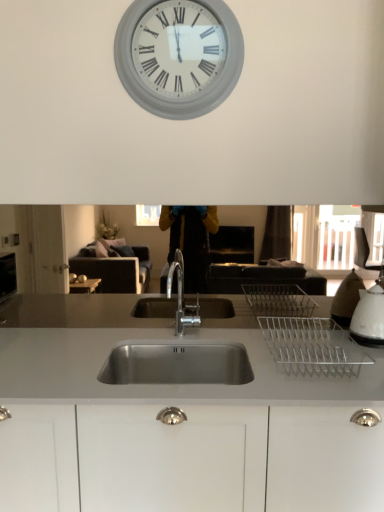
Question: Does white matte clock at upper center contain white glossy kettle at right?

Choices:
 (A) yes
 (B) no

Answer: (B)

Question: Does white matte clock at upper center appear on the left side of white glossy kettle at right?

Choices:
 (A) yes
 (B) no

Answer: (A)

Question: Is white matte clock at upper center positioned in front of white glossy kettle at right?

Choices:
 (A) yes
 (B) no

Answer: (B)

Question: Considering the relative sizes of white matte clock at upper center and white glossy kettle at right in the image provided, is white matte clock at upper center bigger than white glossy kettle at right?

Choices:
 (A) yes
 (B) no

Answer: (A)

Question: Is white matte clock at upper center looking in the opposite direction of white glossy kettle at right?

Choices:
 (A) no
 (B) yes

Answer: (A)

Question: Considering their positions, is white glossy kettle at right located in front of or behind white matte clock at upper center?

Choices:
 (A) front
 (B) behind

Answer: (A)

Question: From the image's perspective, is white glossy kettle at right positioned above or below white matte clock at upper center?

Choices:
 (A) above
 (B) below

Answer: (B)

Question: From a real-world perspective, relative to white matte clock at upper center, is white glossy kettle at right vertically above or below?

Choices:
 (A) below
 (B) above

Answer: (A)

Question: In the image, is white glossy kettle at right on the left side or the right side of white matte clock at upper center?

Choices:
 (A) right
 (B) left

Answer: (A)

Question: Is white matte clock at upper center inside the boundaries of white glossy kettle at right, or outside?

Choices:
 (A) outside
 (B) inside

Answer: (A)

Question: Would you say white matte clock at upper center is to the left or to the right of white glossy kettle at right in the picture?

Choices:
 (A) left
 (B) right

Answer: (A)

Question: From the image's perspective, is white matte clock at upper center located above or below white glossy kettle at right?

Choices:
 (A) above
 (B) below

Answer: (A)

Question: Is white matte clock at upper center wider or thinner than white glossy kettle at right?

Choices:
 (A) thin
 (B) wide

Answer: (A)

Question: Is stainless steel sink at center taller or shorter than white glossy kettle at right?

Choices:
 (A) short
 (B) tall

Answer: (B)

Question: From a real-world perspective, is stainless steel sink at center above or below white glossy kettle at right?

Choices:
 (A) below
 (B) above

Answer: (A)